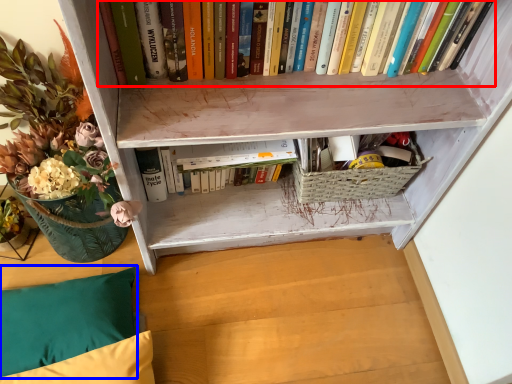
Question: Which object is closer to the camera taking this photo, book (highlighted by a red box) or pillow (highlighted by a blue box)?

Choices:
 (A) book
 (B) pillow

Answer: (A)